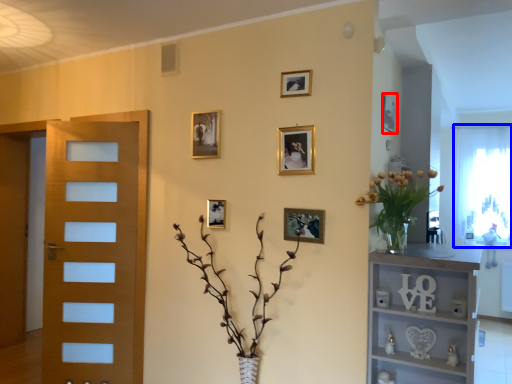
Question: Which of the following is the closest to the observer, picture frame (highlighted by a red box) or window screen (highlighted by a blue box)?

Choices:
 (A) picture frame
 (B) window screen

Answer: (A)